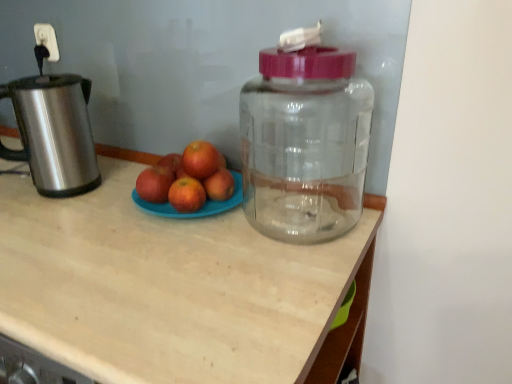
Identify the location of free location to the right of red matte grapefruit at center, the first grapefruit when ordered from bottom to top. The width and height of the screenshot is (512, 384). (232, 202).